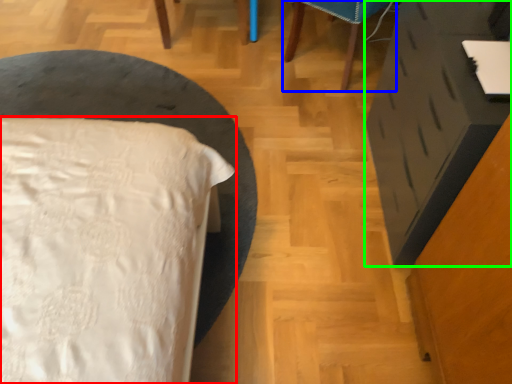
Question: Considering the real-world distances, which object is closest to bed (highlighted by a red box)? furniture (highlighted by a blue box) or vanity (highlighted by a green box).

Choices:
 (A) furniture
 (B) vanity

Answer: (B)